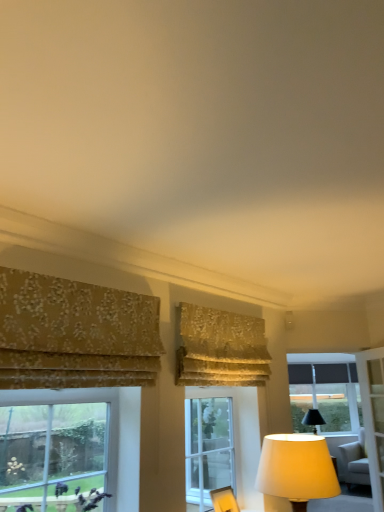
Question: From their relative heights in the image, would you say gold floral fabric curtain at left, positioned as the first curtain in left-to-right order, is taller or shorter than clear glass window at center, which is the 2th window in top-to-bottom order?

Choices:
 (A) short
 (B) tall

Answer: (A)

Question: Choose the correct answer: Is gold floral fabric curtain at left, the second curtain in the right-to-left sequence, inside clear glass window at center, which appears as the second window when ordered from the bottom, or outside it?

Choices:
 (A) outside
 (B) inside

Answer: (A)

Question: Considering the real-world distances, which object is farthest from the gold floral fabric curtain at left, placed as the second curtain when sorted from back to front?

Choices:
 (A) floral fabric curtain at upper center, placed as the 1th curtain when sorted from back to front
 (B) matte yellow fabric lampshade at lower right
 (C) clear glass window at upper right
 (D) black fabric window at right, which ranks as the third window in front-to-back order
 (E) light gray fabric swivel chair at lower right

Answer: (E)

Question: Which object is the farthest from the clear glass window at center, which is the 2th window in top-to-bottom order?

Choices:
 (A) black fabric window at right, which ranks as the third window in top-to-bottom order
 (B) floral fabric curtain at upper center, placed as the 1th curtain when sorted from back to front
 (C) clear glass window at upper right
 (D) clear glass window at lower left, placed as the first window when sorted from front to back
 (E) light gray fabric swivel chair at lower right

Answer: (A)